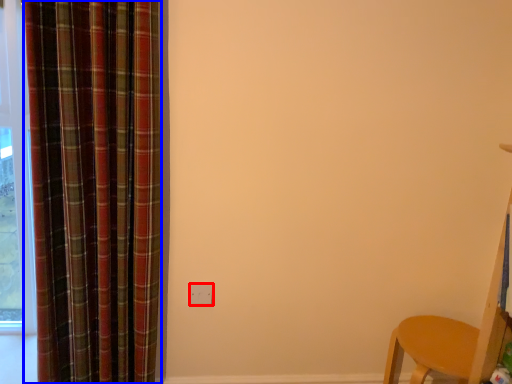
Question: Among these objects, which one is farthest to the camera, electric outlet (highlighted by a red box) or curtain (highlighted by a blue box)?

Choices:
 (A) electric outlet
 (B) curtain

Answer: (A)